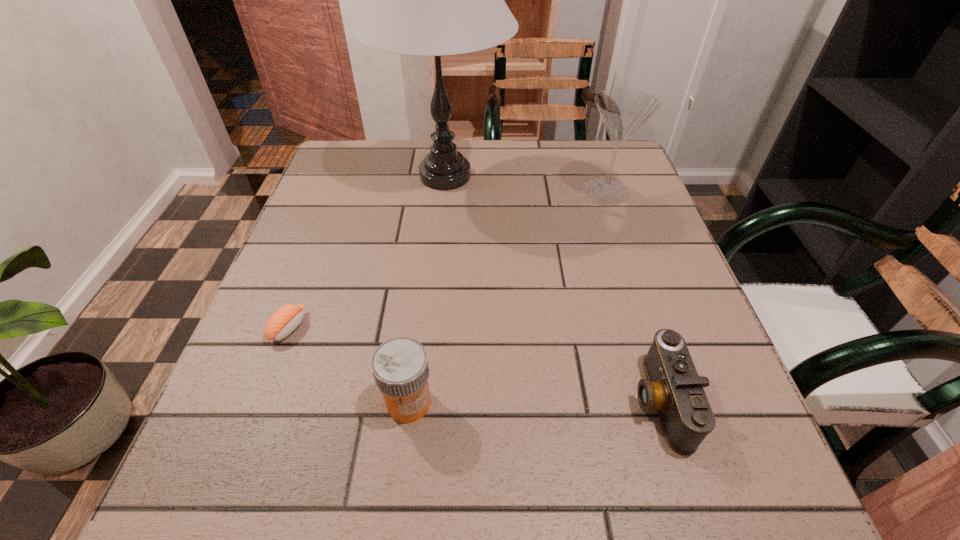
At what (x,y) coordinates should I click in order to perform the action: click on vacant area that lies between the lamp and the fourth tallest object. Please return your answer as a coordinate pair (x, y). Image resolution: width=960 pixels, height=540 pixels. Looking at the image, I should click on (553, 288).

The height and width of the screenshot is (540, 960). Identify the location of unoccupied position between the leftmost object and the lamp. (367, 252).

Image resolution: width=960 pixels, height=540 pixels. In order to click on empty space that is in between the camera and the third tallest object in this screenshot , I will do `click(535, 401)`.

The width and height of the screenshot is (960, 540). In order to click on vacant region between the fourth tallest object and the flute glass in this screenshot , I will do `click(633, 296)`.

Find the location of a particular element. This screenshot has width=960, height=540. free space between the tallest object and the shortest object is located at coordinates (367, 252).

The image size is (960, 540). In order to click on blank region between the flute glass and the leftmost object in this screenshot , I will do `click(447, 259)`.

This screenshot has width=960, height=540. Identify the location of free space between the shortest object and the camera. (474, 364).

Locate an element on the screen. free point between the second shortest object and the flute glass is located at coordinates (633, 296).

In order to click on free space between the leftmost object and the flute glass in this screenshot , I will do `click(447, 259)`.

At what (x,y) coordinates should I click in order to perform the action: click on vacant space in between the fourth shortest object and the fourth tallest object. Please return your answer as a coordinate pair (x, y). The height and width of the screenshot is (540, 960). Looking at the image, I should click on (633, 296).